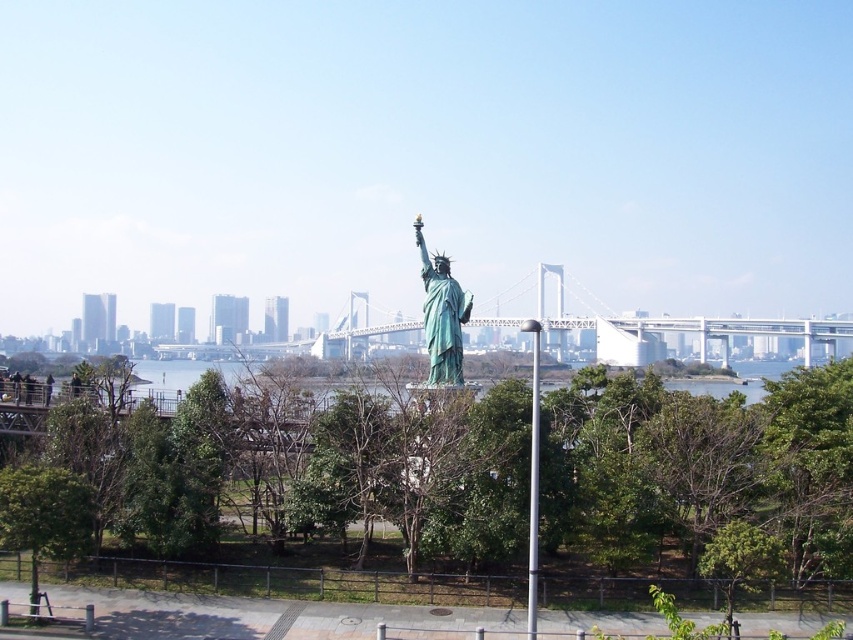
Based on the photo, you are a tourist holding a map and standing in front of the green polished metal statue at center. You want to take a photo of the green leafy tree at center from the statue. Which direction should you walk to frame the tree in your camera view?

The green leafy tree at center is positioned on the left side of green polished metal statue at center, so you should walk to the left to frame the tree in your camera view.

Consider the image. You are a landscape architect designing a new park and want to place a bench between the green leafy tree at center and the green polished metal statue at center. What is the minimum distance the bench should be placed from each object to ensure it is equidistant from both?

The bench should be placed exactly halfway between the green leafy tree at center and the green polished metal statue at center. Since they are 17.00 meters apart, the midpoint would be 8.50 meters from each object.

You are a tourist standing in front of the Statue of Liberty replica and see the green leafy tree at center and the silver metallic pole at center. Which object is closer to your left side?

The green leafy tree at center is positioned on the left side of the silver metallic pole at center, so it is closer to your left side.